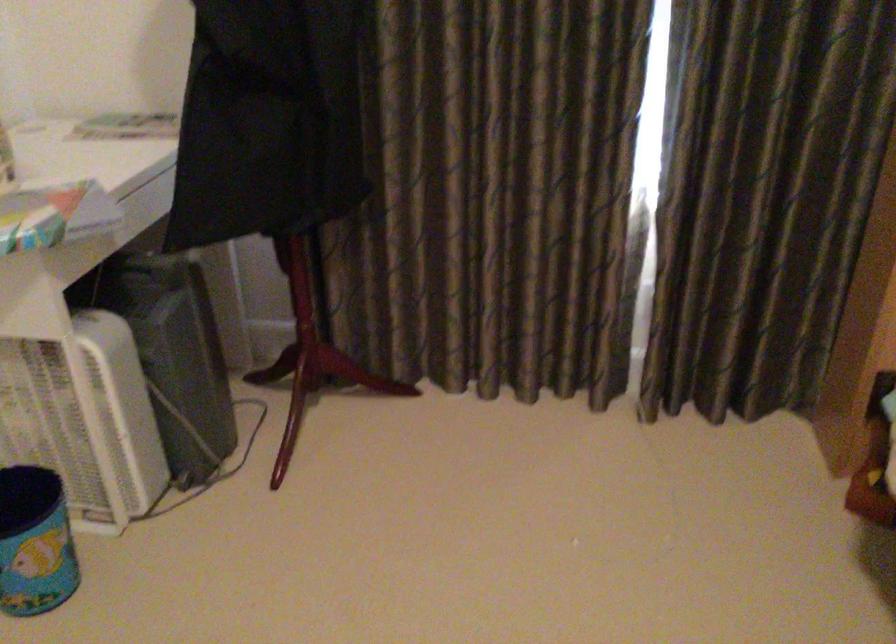
Describe the element at coordinates (865, 298) in the screenshot. Image resolution: width=896 pixels, height=644 pixels. I see `the dark curtain edge` at that location.